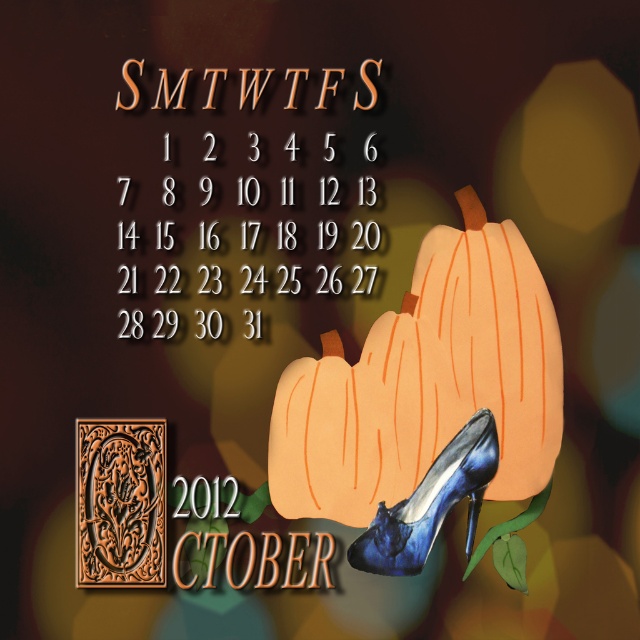
You are designing a digital calendar and need to place a decorative element. Given the orange matte pumpkin at center, where should you position it to match the original image?

The orange matte pumpkin at center should be positioned at point (426,381) to match the original image.